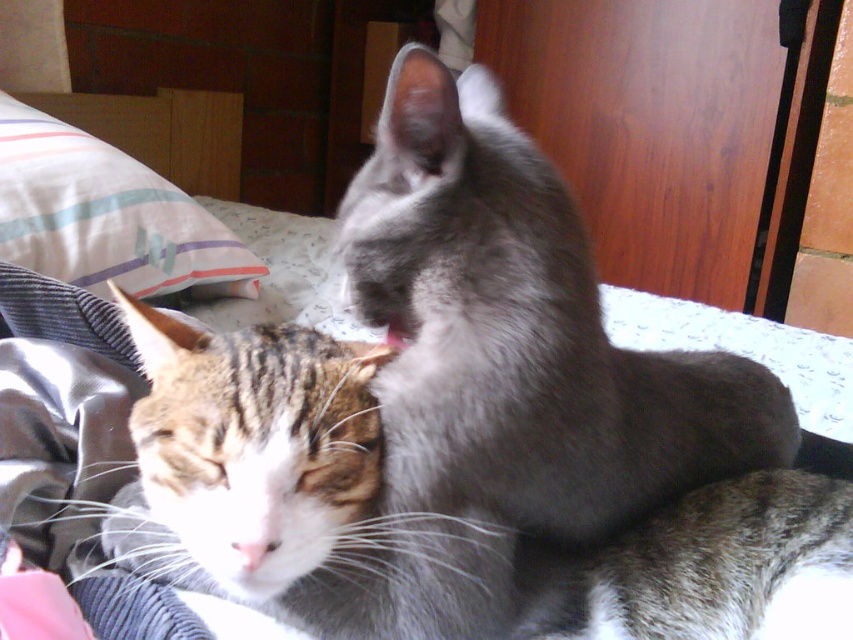
You are standing in the room and see two points marked on the bed where the cats are resting. The first point is at coordinates point (x=415, y=104) and the second is at point (x=235, y=289). Which point is closer to you?

Point (x=415, y=104) is in front of point (x=235, y=289), so it is closer to you.

You are a photographer trying to capture the gray fluffy cat at center in the image. The camera is set to focus on the point at coordinates point (520, 333). Will this point be effective for focusing on the gray fluffy cat at center?

Yes, the point (520, 333) marks the gray fluffy cat at center, so focusing there will effectively capture it.

You are a photographer taking a picture of the two cats in the scene. The gray fluffy cat at center is at point [520,333]. Where should you focus your camera to ensure the gray fluffy cat at center is in sharp focus?

The camera should focus on point [520,333] where the gray fluffy cat at center is located to ensure it is in sharp focus.